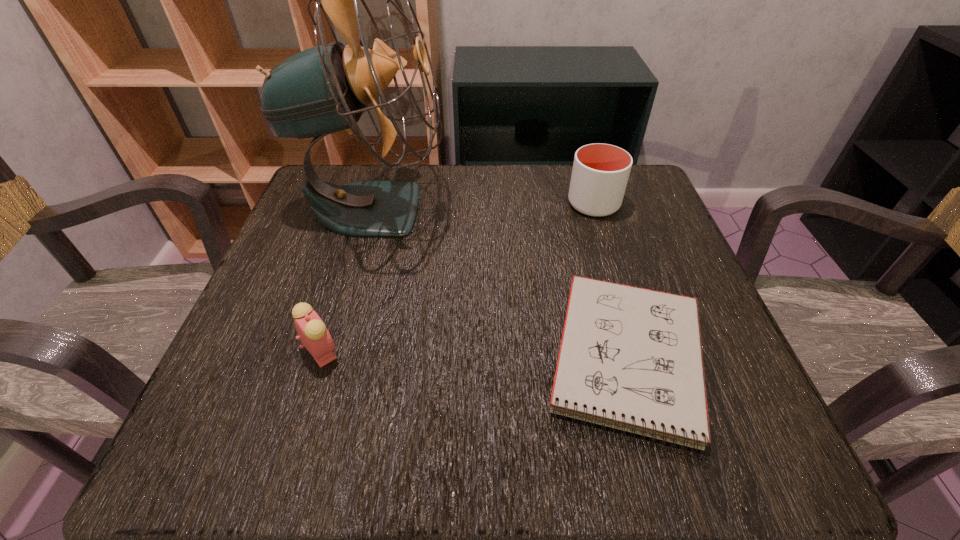
Where is `vacant area that lies between the notepad and the alarm clock`? vacant area that lies between the notepad and the alarm clock is located at coordinates (x=475, y=355).

Locate an element on the screen. This screenshot has height=540, width=960. empty space between the fan and the cup is located at coordinates (484, 206).

This screenshot has height=540, width=960. In order to click on blank region between the third tallest object and the cup in this screenshot , I will do `click(458, 278)`.

Image resolution: width=960 pixels, height=540 pixels. In order to click on free area in between the fan and the cup in this screenshot , I will do 484,206.

Identify the location of free space between the third tallest object and the third shortest object. (458, 278).

Find the location of `the closest object to the fan`. the closest object to the fan is located at coordinates (314, 336).

You are a GUI agent. You are given a task and a screenshot of the screen. Output one action in this format:
    pyautogui.click(x=<x>, y=<y>)
    Task: Click on the object that ranks as the closest to the cup
    The height and width of the screenshot is (540, 960).
    Given the screenshot: What is the action you would take?
    pyautogui.click(x=630, y=358)

Where is `free point that satisfies the following two spatial constraints: 1. on the back side of the notepad; 2. on the face of the alarm clock`? The width and height of the screenshot is (960, 540). free point that satisfies the following two spatial constraints: 1. on the back side of the notepad; 2. on the face of the alarm clock is located at coordinates (627, 351).

Where is `vacant space that satisfies the following two spatial constraints: 1. on the face of the alarm clock; 2. on the back side of the shortest object`? This screenshot has height=540, width=960. vacant space that satisfies the following two spatial constraints: 1. on the face of the alarm clock; 2. on the back side of the shortest object is located at coordinates (319, 359).

Locate an element on the screen. Image resolution: width=960 pixels, height=540 pixels. vacant space that satisfies the following two spatial constraints: 1. on the front-facing side of the fan for air flow; 2. on the back side of the shortest object is located at coordinates (330, 359).